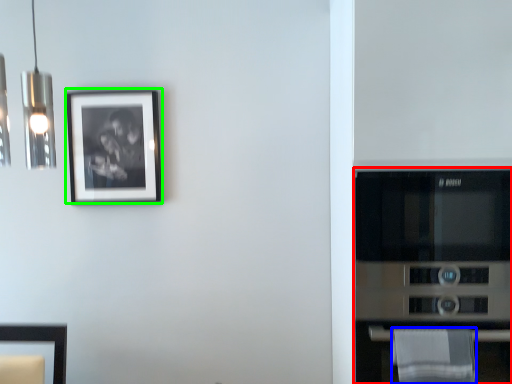
Question: Which object is the closest to the appliance (highlighted by a red box)? Choose among these: cloth (highlighted by a blue box) or picture frame (highlighted by a green box).

Choices:
 (A) cloth
 (B) picture frame

Answer: (A)